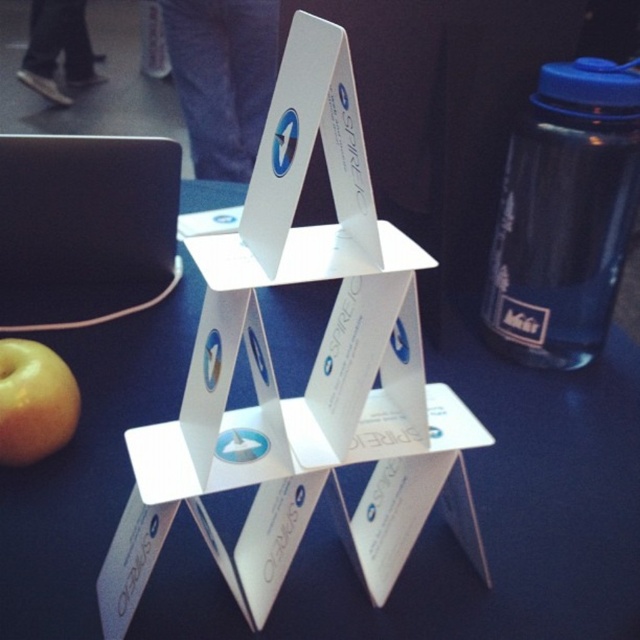
Does blue plastic bottle at right have a larger size compared to yellow matte apple at lower left?

Indeed, blue plastic bottle at right has a larger size compared to yellow matte apple at lower left.

Consider the image. Is blue plastic bottle at right smaller than yellow matte apple at lower left?

Actually, blue plastic bottle at right might be larger than yellow matte apple at lower left.

Which is in front, point (552, 163) or point (19, 342)?

Point (19, 342) is more forward.

I want to click on blue plastic bottle at right, so click(564, 214).

Does point (630, 634) lie behind point (35, 452)?

No, (630, 634) is in front of (35, 452).

Is white cardboard structure at center taller than yellow matte apple at lower left?

Yes, white cardboard structure at center is taller than yellow matte apple at lower left.

Describe the element at coordinates (477, 522) in the screenshot. I see `white cardboard structure at center` at that location.

Where is `white cardboard structure at center`? white cardboard structure at center is located at coordinates (477, 522).

Is white cardboard structure at center shorter than blue plastic bottle at right?

No.

Between white cardboard structure at center and blue plastic bottle at right, which one appears on the left side from the viewer's perspective?

white cardboard structure at center

Is point (330, 628) closer to camera compared to point (570, 195)?

Yes, point (330, 628) is in front of point (570, 195).

Image resolution: width=640 pixels, height=640 pixels. Find the location of `white cardboard structure at center`. white cardboard structure at center is located at coordinates (477, 522).